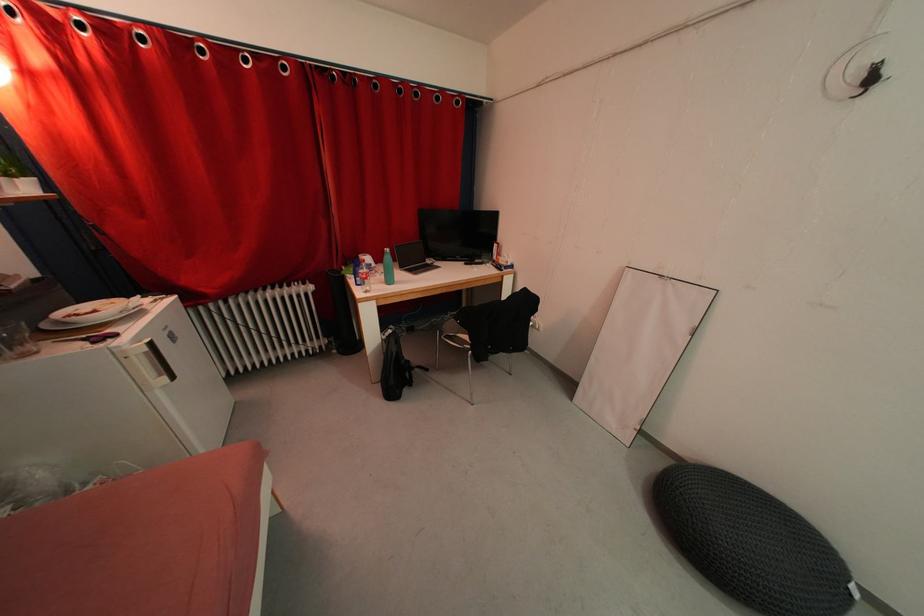
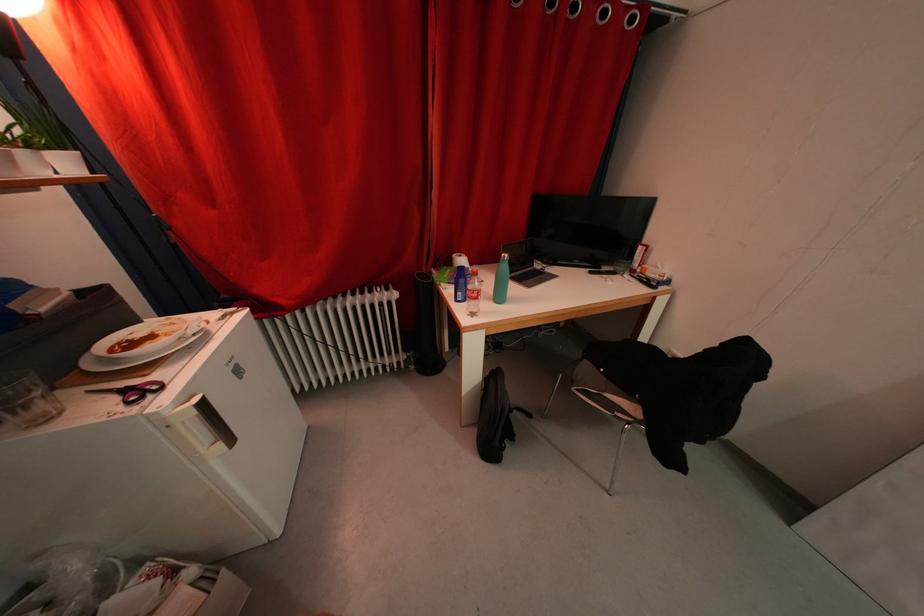
The point at (x=402, y=383) is marked in the first image. Where is the corresponding point in the second image?

(500, 432)